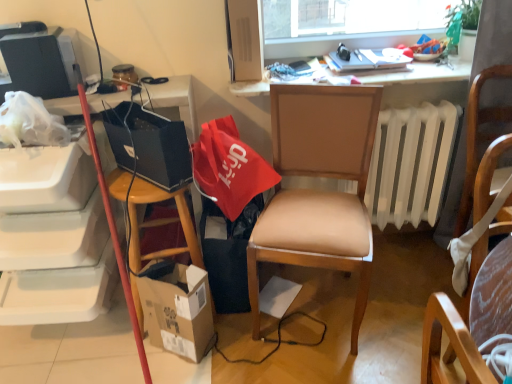
The image size is (512, 384). I want to click on spots to the right of black fabric trash bin/can at lower center, so click(x=293, y=295).